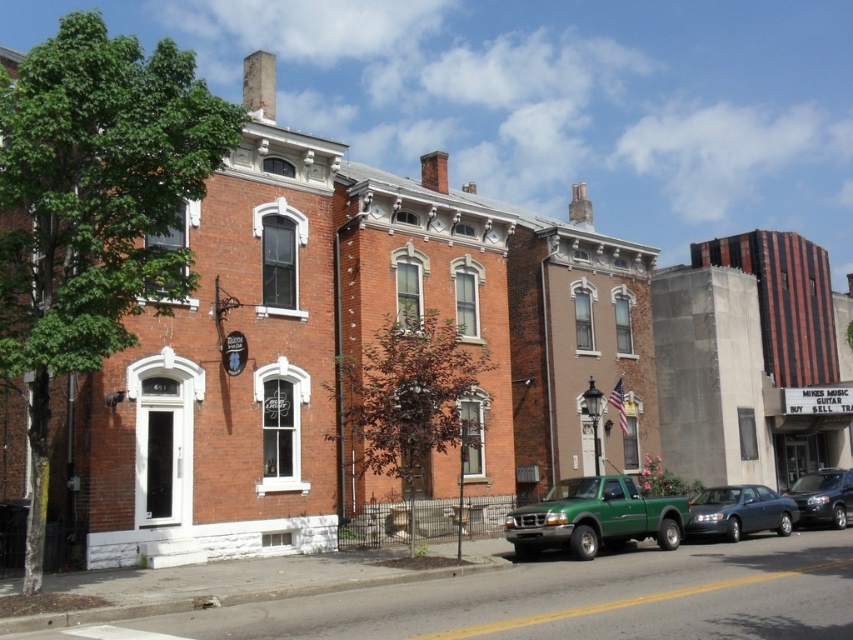
Is point (694, 506) positioned before point (822, 476)?

Yes.

Which is behind, point (788, 500) or point (833, 486)?

The point (833, 486) is behind.

You are a GUI agent. You are given a task and a screenshot of the screen. Output one action in this format:
    pyautogui.click(x=<x>, y=<y>)
    Task: Click on the metallic gray sedan at lower right
    The width and height of the screenshot is (853, 640).
    Given the screenshot: What is the action you would take?
    pyautogui.click(x=740, y=512)

Between point (651, 515) and point (769, 502), which one is positioned behind?

Positioned behind is point (769, 502).

Image resolution: width=853 pixels, height=640 pixels. In order to click on green matte truck at lower center in this screenshot , I will do `click(595, 516)`.

Is green matte truck at lower center bigger than shiny black suv at center right?

No, green matte truck at lower center is not bigger than shiny black suv at center right.

Does green matte truck at lower center lie behind shiny black suv at center right?

No, green matte truck at lower center is closer to the viewer.

Is point (534, 532) positioned in front of point (822, 516)?

Yes, it is.

Identify the location of green matte truck at lower center. (595, 516).